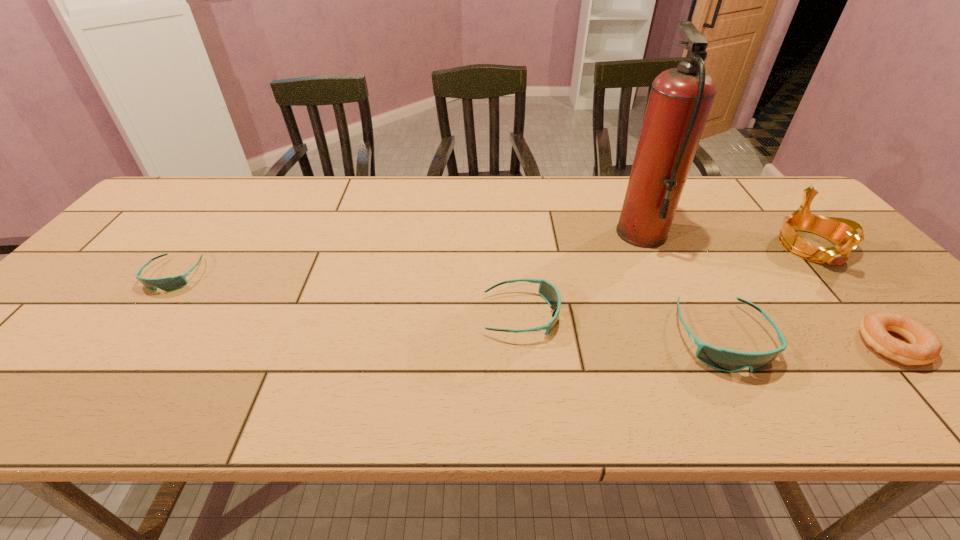
Find the location of `empty space between the leftmost object and the second tallest object`. empty space between the leftmost object and the second tallest object is located at coordinates (493, 261).

Identify the location of empty location between the tallest sunglasses and the second sunglasses from right to left. Image resolution: width=960 pixels, height=540 pixels. (622, 326).

Locate an element on the screen. The width and height of the screenshot is (960, 540). vacant area between the leftmost object and the second sunglasses from left to right is located at coordinates (348, 295).

At what (x,y) coordinates should I click in order to perform the action: click on free space that is in between the fourth tallest object and the rightmost sunglasses. Please return your answer as a coordinate pair (x, y). The height and width of the screenshot is (540, 960). Looking at the image, I should click on [622, 326].

Locate an element on the screen. The image size is (960, 540). free space between the bagel and the shortest sunglasses is located at coordinates (534, 310).

Locate an element on the screen. The image size is (960, 540). unoccupied area between the bagel and the tallest sunglasses is located at coordinates (807, 341).

Locate which object ranks third in proximity to the fifth object from right to left. Please provide its 2D coordinates. Your answer should be formatted as a tuple, i.e. [(x, y)], where the tuple contains the x and y coordinates of a point satisfying the conditions above.

[(846, 234)]

The height and width of the screenshot is (540, 960). I want to click on object that can be found as the second closest to the rightmost sunglasses, so click(x=925, y=346).

This screenshot has width=960, height=540. In order to click on sunglasses that can be found as the closest to the leftmost object in this screenshot , I will do `click(547, 290)`.

This screenshot has width=960, height=540. I want to click on sunglasses identified as the second closest to the third shortest object, so click(x=167, y=284).